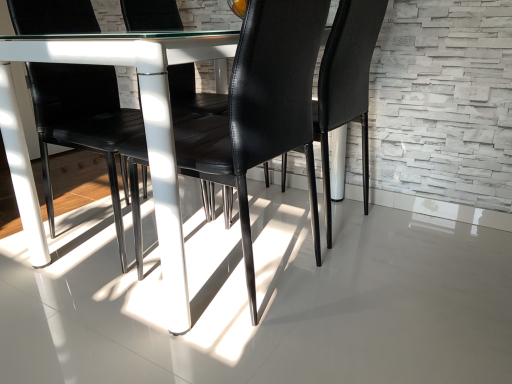
Locate an element on the screen. This screenshot has height=384, width=512. free space in front of black leather chair at center, arranged as the first chair when viewed from the back is located at coordinates (371, 277).